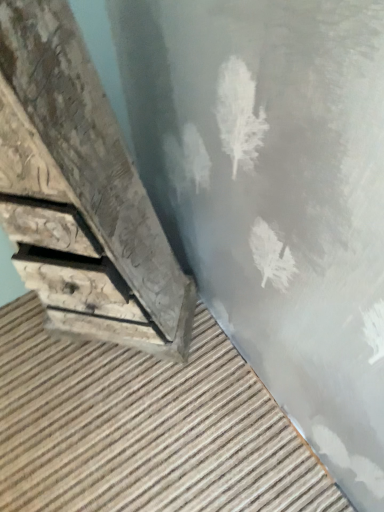
Locate an element on the screen. The width and height of the screenshot is (384, 512). wooden carved window at left is located at coordinates (81, 193).

Describe the element at coordinates (81, 193) in the screenshot. I see `wooden carved window at left` at that location.

The height and width of the screenshot is (512, 384). I want to click on wooden carved window at left, so click(81, 193).